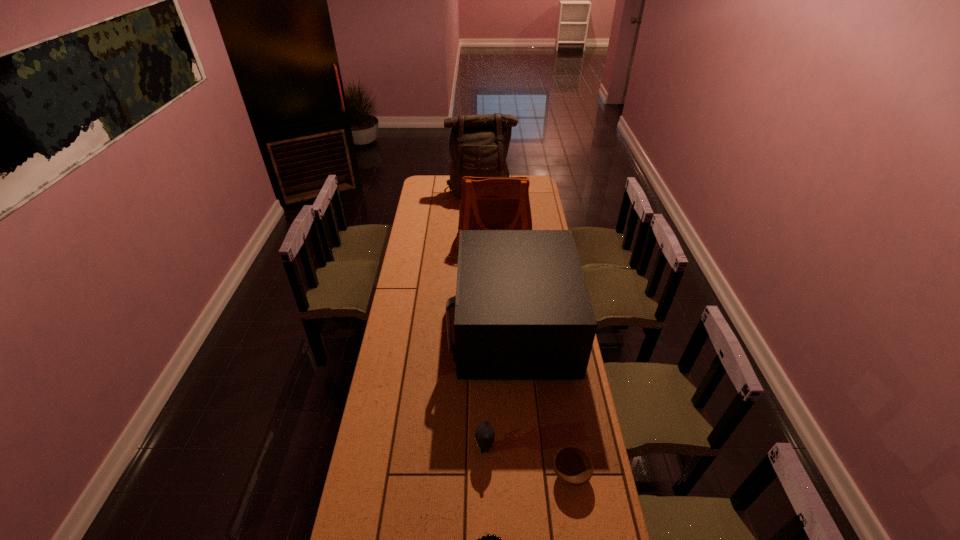
Identify the location of free space that satisfies the following two spatial constraints: 1. on the front pocket of the fifth shortest object; 2. on the front-facing side of the kitten. (503, 448).

Locate an element on the screen. vacant space that satisfies the following two spatial constraints: 1. on the front-facing side of the kitten; 2. on the right side of the fifth tallest object is located at coordinates (485, 475).